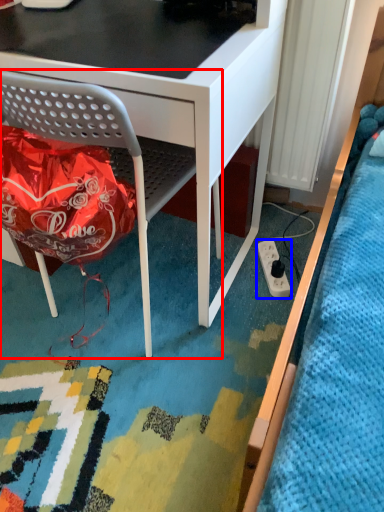
Question: Which object appears closest to the camera in this image, chair (highlighted by a red box) or power plugs and sockets (highlighted by a blue box)?

Choices:
 (A) chair
 (B) power plugs and sockets

Answer: (A)